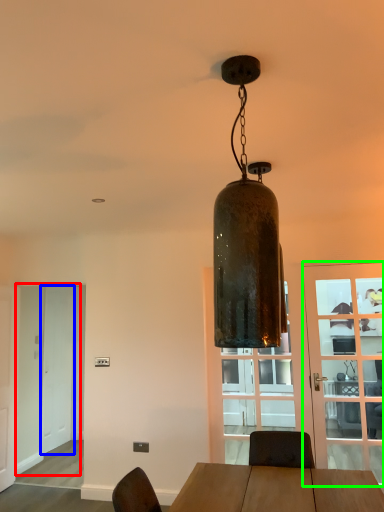
Question: Which object is positioned closest to screen door (highlighted by a red box)? Select from screen door (highlighted by a blue box) and door (highlighted by a green box).

Choices:
 (A) screen door
 (B) door

Answer: (A)